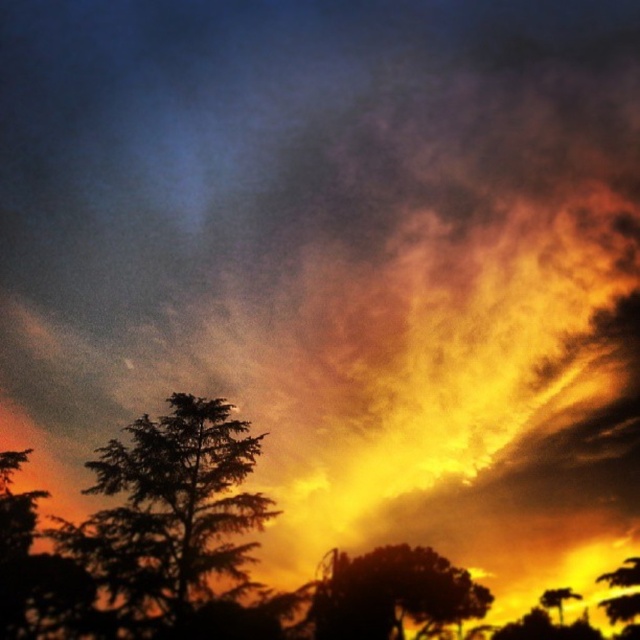
You are an artist trying to paint the sunset scene. You want to ensure the trees are proportionally accurate. Which tree should you paint narrower when comparing the silhouette leafy tree at center and the silky green leafy tree at lower right?

The silhouette leafy tree at center should be painted narrower since it has a lesser width compared to the silky green leafy tree at lower right.

You are an artist trying to paint the sunset scene. You want to place the silhouette leafy tree at center and silky brown tree at lower right in your painting. Based on their positions, which tree should you paint first to create a sense of depth?

You should paint the silky brown tree at lower right first because it is farther away from the viewer. By layering the closer silhouette leafy tree at center on top, you can create a sense of depth in the painting.

You are an artist trying to paint the sunset scene. You want to ensure that the silhouette leafy tree at center and the silky green leafy tree at lower right are proportionally accurate. Which tree should you make smaller in your painting?

The silhouette leafy tree at center should be made smaller in the painting because it occupies less space than the silky green leafy tree at lower right according to the description.